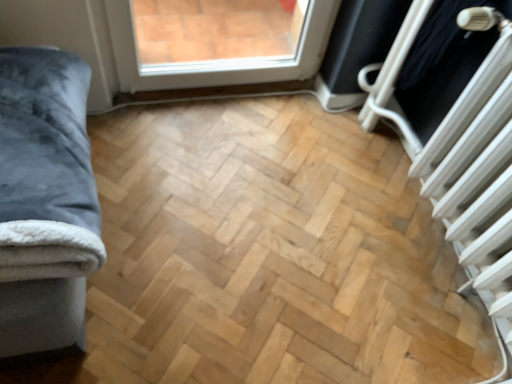
Question: From the image's perspective, is white metallic radiator at right on velvet grey blanket at left?

Choices:
 (A) yes
 (B) no

Answer: (B)

Question: Are white metallic radiator at right and velvet grey blanket at left making contact?

Choices:
 (A) no
 (B) yes

Answer: (A)

Question: Can you confirm if white metallic radiator at right is taller than velvet grey blanket at left?

Choices:
 (A) yes
 (B) no

Answer: (A)

Question: Is the position of white metallic radiator at right more distant than that of velvet grey blanket at left?

Choices:
 (A) no
 (B) yes

Answer: (B)

Question: Is white metallic radiator at right outside velvet grey blanket at left?

Choices:
 (A) yes
 (B) no

Answer: (A)

Question: Considering the relative sizes of white metallic radiator at right and velvet grey blanket at left in the image provided, is white metallic radiator at right wider than velvet grey blanket at left?

Choices:
 (A) yes
 (B) no

Answer: (B)

Question: Is white plastic radiator at upper right oriented away from velvet grey blanket at left?

Choices:
 (A) no
 (B) yes

Answer: (A)

Question: From the image's perspective, would you say white plastic radiator at upper right is positioned over velvet grey blanket at left?

Choices:
 (A) no
 (B) yes

Answer: (B)

Question: Is white plastic radiator at upper right smaller than velvet grey blanket at left?

Choices:
 (A) no
 (B) yes

Answer: (B)

Question: Can you confirm if white plastic radiator at upper right is positioned to the right of velvet grey blanket at left?

Choices:
 (A) yes
 (B) no

Answer: (A)

Question: Considering the relative sizes of white plastic radiator at upper right and velvet grey blanket at left in the image provided, is white plastic radiator at upper right shorter than velvet grey blanket at left?

Choices:
 (A) yes
 (B) no

Answer: (B)

Question: Does white plastic radiator at upper right have a greater width compared to velvet grey blanket at left?

Choices:
 (A) yes
 (B) no

Answer: (B)

Question: From the image's perspective, is white plastic radiator at upper right located beneath white metallic radiator at right?

Choices:
 (A) yes
 (B) no

Answer: (B)